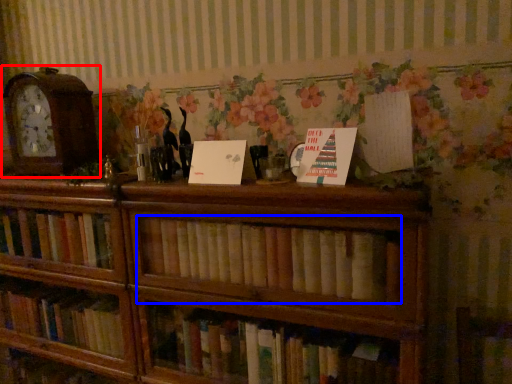
Question: Which object is further to the camera taking this photo, alarm clock (highlighted by a red box) or book (highlighted by a blue box)?

Choices:
 (A) alarm clock
 (B) book

Answer: (A)